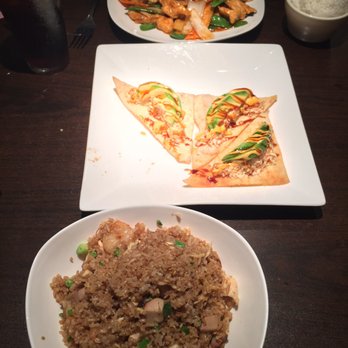
Where is `wood table`? The height and width of the screenshot is (348, 348). wood table is located at coordinates tap(72, 127).